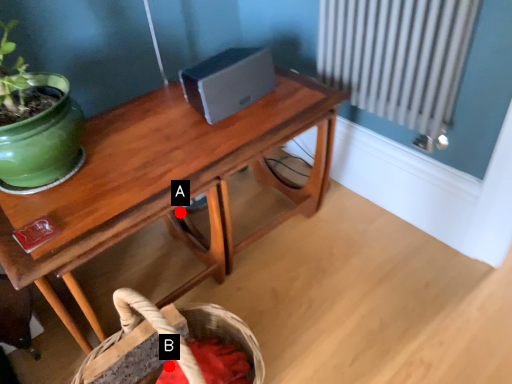
Question: Two points are circled on the image, labeled by A and B beside each circle. Among these points, which one is farthest from the camera?

Choices:
 (A) A is further
 (B) B is further

Answer: (A)